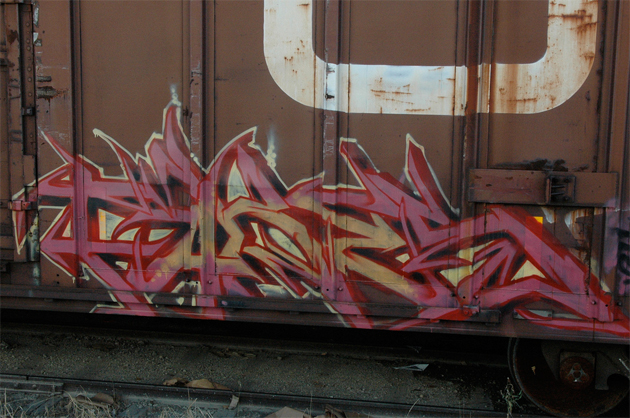
At what (x,y) coordinates should I click in order to perform the action: click on latch. Please return your answer as a coordinate pair (x, y). The image size is (630, 418). Looking at the image, I should click on click(524, 188).